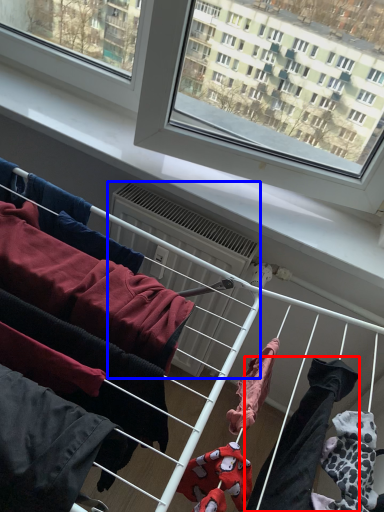
Question: Which object is closer to the camera taking this photo, clothing (highlighted by a red box) or air conditioner (highlighted by a blue box)?

Choices:
 (A) clothing
 (B) air conditioner

Answer: (A)